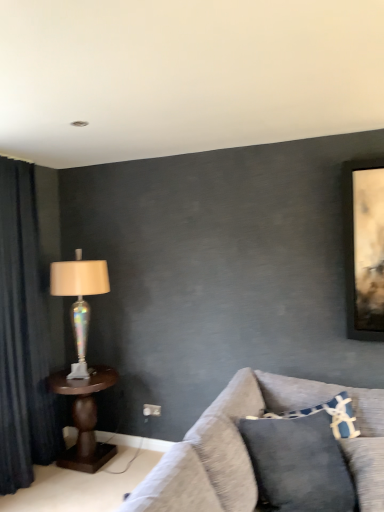
Question: Is dark blue fabric curtain at left bigger than iridescent glass lamp at left?

Choices:
 (A) yes
 (B) no

Answer: (A)

Question: Is dark blue fabric curtain at left positioned with its back to iridescent glass lamp at left?

Choices:
 (A) no
 (B) yes

Answer: (A)

Question: Is dark blue fabric curtain at left further to camera compared to iridescent glass lamp at left?

Choices:
 (A) yes
 (B) no

Answer: (B)

Question: Would you say iridescent glass lamp at left is part of dark blue fabric curtain at left's contents?

Choices:
 (A) yes
 (B) no

Answer: (B)

Question: Is dark blue fabric curtain at left to the right of iridescent glass lamp at left from the viewer's perspective?

Choices:
 (A) yes
 (B) no

Answer: (B)

Question: From the image's perspective, is brown wooden table at left located above or below iridescent glass lamp at left?

Choices:
 (A) below
 (B) above

Answer: (A)

Question: Considering the relative positions of brown wooden table at left and iridescent glass lamp at left in the image provided, is brown wooden table at left to the left or to the right of iridescent glass lamp at left?

Choices:
 (A) right
 (B) left

Answer: (A)

Question: Looking at the image, does brown wooden table at left seem bigger or smaller compared to iridescent glass lamp at left?

Choices:
 (A) small
 (B) big

Answer: (B)

Question: Relative to iridescent glass lamp at left, is brown wooden table at left in front or behind?

Choices:
 (A) front
 (B) behind

Answer: (A)

Question: Is textured gray couch at lower right inside the boundaries of iridescent glass lamp at left, or outside?

Choices:
 (A) inside
 (B) outside

Answer: (B)

Question: Looking at the image, does textured gray couch at lower right seem bigger or smaller compared to iridescent glass lamp at left?

Choices:
 (A) small
 (B) big

Answer: (B)

Question: Considering the positions of point (226, 506) and point (74, 340), is point (226, 506) closer or farther from the camera than point (74, 340)?

Choices:
 (A) farther
 (B) closer

Answer: (B)

Question: From the image's perspective, is textured gray couch at lower right located above or below iridescent glass lamp at left?

Choices:
 (A) below
 (B) above

Answer: (A)

Question: Is textured gray couch at lower right bigger or smaller than dark blue fabric curtain at left?

Choices:
 (A) big
 (B) small

Answer: (A)

Question: Visually, is textured gray couch at lower right positioned to the left or to the right of dark blue fabric curtain at left?

Choices:
 (A) right
 (B) left

Answer: (A)